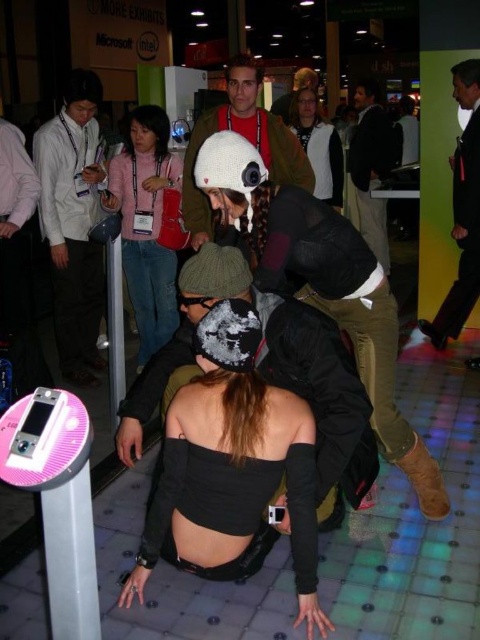
You are a security guard in the convention hall. You need to ensure that all attendees maintain a minimum distance of 1.5 meters apart for safety. You observe the white knitted hat at center and the black leather jacket at upper right. Can they remain in their current positions without violating the safety guidelines?

The white knitted hat at center and the black leather jacket at upper right are 1.46 meters apart from each other. Since this distance is less than the required 1.5 meters, they are violating the safety guidelines and need to adjust their positions to maintain the minimum distance.

You are a photographer trying to capture a clear shot of both the black matte top at center and the matte white jacket at upper center. Based on their heights, which one might require you to adjust your camera angle upwards to include fully in the frame?

The black matte top at center is shorter than the matte white jacket at upper center, so you would need to adjust your camera angle upwards to include the taller matte white jacket at upper center fully in the frame.

You are standing in the convention hall and see the white knitted hat at center. If you move 0.1 units to the right and 0.05 units up from your current position, will you be closer to the hat?

Moving 0.1 units to the right and 0.05 units up would take you to position (267,202). The white knitted hat at center is at (243,138). The distance between the new position and the hat is sqrt of squared differences in coordinates. Since moving right and up increases the distance, you would be farther from the hat.